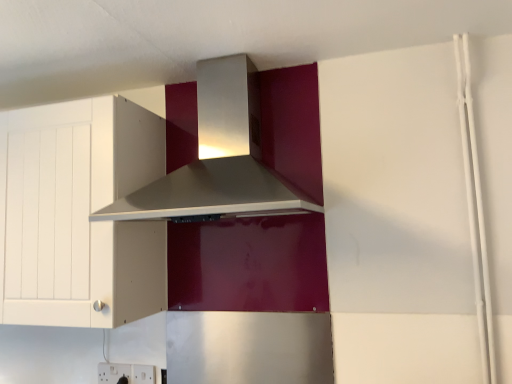
At what (x,y) coordinates should I click in order to perform the action: click on free point above satin silver range hood at upper center (from a real-world perspective). Please return your answer as a coordinate pair (x, y). The height and width of the screenshot is (384, 512). Looking at the image, I should click on (214, 42).